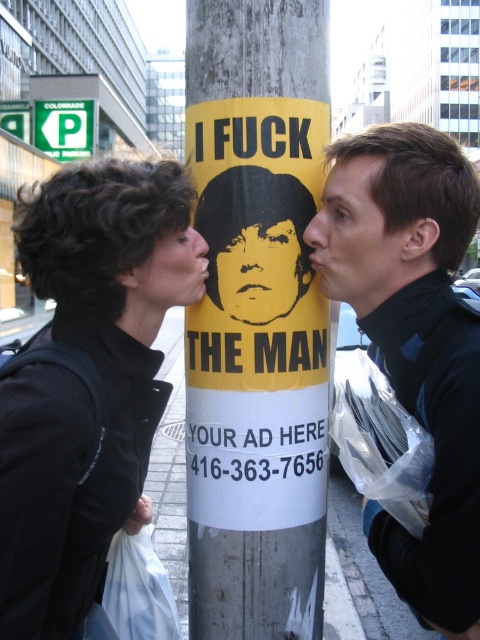
Does black matte jacket at right have a greater height compared to smooth skin face at center?

Correct, black matte jacket at right is much taller as smooth skin face at center.

Consider the image. Is black matte jacket at right shorter than smooth skin face at center?

In fact, black matte jacket at right may be taller than smooth skin face at center.

Consider the image. Who is more distant from viewer, (385, 346) or (385, 292)?

The point (385, 346) is more distant.

Identify the location of black matte jacket at right. The image size is (480, 640). (414, 340).

Describe the element at coordinates (358, 240) in the screenshot. I see `smooth skin face at center` at that location.

Locate an element on the screen. This screenshot has height=640, width=480. smooth skin face at center is located at coordinates (358, 240).

Is black matte jacket at left in front of matte black face at center?

Yes, it is in front of matte black face at center.

Is black matte jacket at left further to the viewer compared to matte black face at center?

No, black matte jacket at left is closer to the viewer.

Which is behind, point (48, 588) or point (170, 244)?

The point (170, 244) is behind.

Find the location of a particular element. The image size is (480, 640). black matte jacket at left is located at coordinates (84, 384).